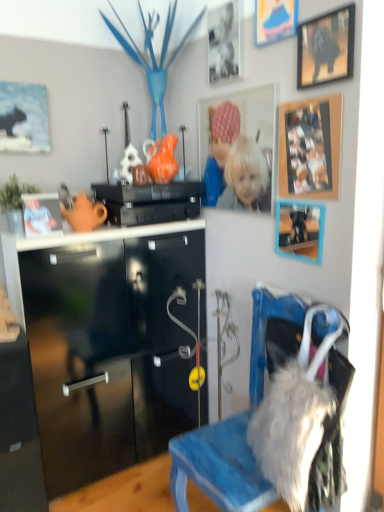
Question: Is black plastic speaker at center to the left of fuzzy gray fur at lower right from the viewer's perspective?

Choices:
 (A) yes
 (B) no

Answer: (A)

Question: Would you say black plastic speaker at center is a long distance from fuzzy gray fur at lower right?

Choices:
 (A) no
 (B) yes

Answer: (B)

Question: Is black plastic speaker at center shorter than fuzzy gray fur at lower right?

Choices:
 (A) no
 (B) yes

Answer: (B)

Question: From the image's perspective, would you say black plastic speaker at center is shown under fuzzy gray fur at lower right?

Choices:
 (A) yes
 (B) no

Answer: (B)

Question: Is black plastic speaker at center next to fuzzy gray fur at lower right?

Choices:
 (A) no
 (B) yes

Answer: (A)

Question: Considering the relative positions of black plastic speaker at center and fuzzy gray fur at lower right in the image provided, is black plastic speaker at center in front of fuzzy gray fur at lower right?

Choices:
 (A) no
 (B) yes

Answer: (A)

Question: From the image's perspective, is fuzzy gray fur at lower right under wooden picture frame at upper right, which appears as the sixth picture frame when viewed from the left?

Choices:
 (A) no
 (B) yes

Answer: (B)

Question: Can you confirm if fuzzy gray fur at lower right is positioned to the left of wooden picture frame at upper right, which appears as the sixth picture frame when viewed from the left?

Choices:
 (A) yes
 (B) no

Answer: (A)

Question: From the image's perspective, is fuzzy gray fur at lower right located above wooden picture frame at upper right, which appears as the sixth picture frame when viewed from the left?

Choices:
 (A) yes
 (B) no

Answer: (B)

Question: Can you confirm if fuzzy gray fur at lower right is thinner than wooden picture frame at upper right, which appears as the sixth picture frame when viewed from the left?

Choices:
 (A) yes
 (B) no

Answer: (B)

Question: Considering the relative positions of fuzzy gray fur at lower right and wooden picture frame at upper right, which appears as the sixth picture frame when viewed from the left, in the image provided, is fuzzy gray fur at lower right to the right of wooden picture frame at upper right, which appears as the sixth picture frame when viewed from the left, from the viewer's perspective?

Choices:
 (A) no
 (B) yes

Answer: (A)

Question: Considering the relative sizes of fuzzy gray fur at lower right and wooden picture frame at upper right, which appears as the sixth picture frame when viewed from the left, in the image provided, is fuzzy gray fur at lower right smaller than wooden picture frame at upper right, which appears as the sixth picture frame when viewed from the left,?

Choices:
 (A) no
 (B) yes

Answer: (A)

Question: Considering the relative positions of blue denim chair at lower right and wooden photo frame at upper center, marked as the fourth picture frame in a right-to-left arrangement, in the image provided, is blue denim chair at lower right to the right of wooden photo frame at upper center, marked as the fourth picture frame in a right-to-left arrangement, from the viewer's perspective?

Choices:
 (A) yes
 (B) no

Answer: (A)